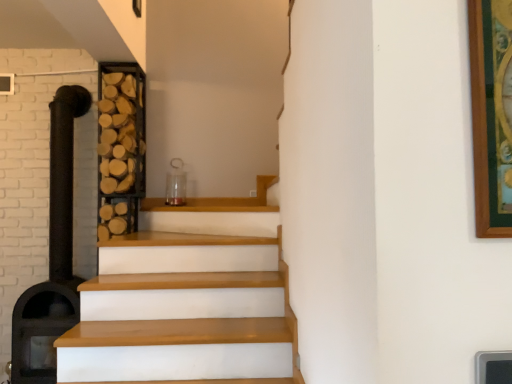
Question: Would you say wooden at left contains black matte fireplace at left?

Choices:
 (A) no
 (B) yes

Answer: (A)

Question: Is wooden at left oriented towards black matte fireplace at left?

Choices:
 (A) no
 (B) yes

Answer: (A)

Question: Is wooden at left located outside black matte fireplace at left?

Choices:
 (A) no
 (B) yes

Answer: (B)

Question: Does wooden at left have a greater width compared to black matte fireplace at left?

Choices:
 (A) no
 (B) yes

Answer: (A)

Question: Does wooden at left have a lesser width compared to black matte fireplace at left?

Choices:
 (A) no
 (B) yes

Answer: (B)

Question: Does wooden at left touch black matte fireplace at left?

Choices:
 (A) no
 (B) yes

Answer: (A)

Question: Would you say black matte fireplace at left is outside wooden at left?

Choices:
 (A) yes
 (B) no

Answer: (A)

Question: From a real-world perspective, is black matte fireplace at left positioned under wooden at left based on gravity?

Choices:
 (A) yes
 (B) no

Answer: (A)

Question: Is black matte fireplace at left smaller than wooden at left?

Choices:
 (A) no
 (B) yes

Answer: (A)

Question: From the image's perspective, is black matte fireplace at left on top of wooden at left?

Choices:
 (A) no
 (B) yes

Answer: (A)

Question: Is the surface of black matte fireplace at left in direct contact with wooden at left?

Choices:
 (A) no
 (B) yes

Answer: (A)

Question: Can you confirm if black matte fireplace at left is shorter than wooden at left?

Choices:
 (A) no
 (B) yes

Answer: (A)

Question: Is point click(x=98, y=178) positioned closer to the camera than point click(x=24, y=317)?

Choices:
 (A) closer
 (B) farther

Answer: (B)